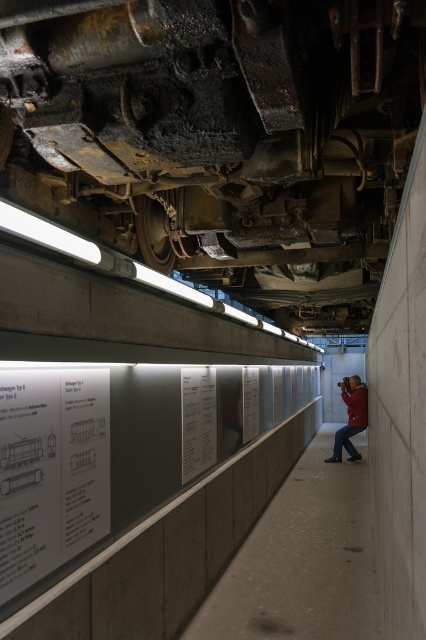
Question: Among these points, which one is farthest from the camera?

Choices:
 (A) (129, 76)
 (B) (336, 448)

Answer: (B)

Question: Which object is the farthest from the red leather jacket at center?

Choices:
 (A) white paper poster at lower left
 (B) rusty metal train car at center

Answer: (A)

Question: From the image, what is the correct spatial relationship of rusty metal train car at center in relation to white paper poster at center?

Choices:
 (A) above
 (B) below

Answer: (A)

Question: Considering the real-world distances, which object is closest to the white paper poster at center?

Choices:
 (A) rusty metal train car at center
 (B) white paper poster at lower left

Answer: (B)

Question: Is rusty metal train car at center wider than white paper poster at center?

Choices:
 (A) no
 (B) yes

Answer: (B)

Question: Does white paper poster at lower left have a lesser width compared to red leather jacket at center?

Choices:
 (A) yes
 (B) no

Answer: (A)